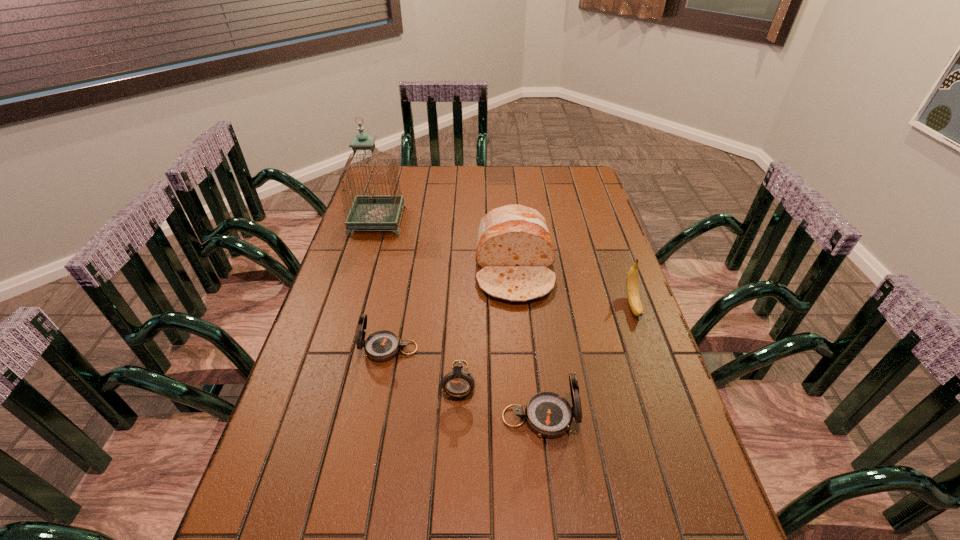
At what (x,y) coordinates should I click in order to perform the action: click on free space located 0.050m on the face of the second tallest compass. Please return your answer as a coordinate pair (x, y). Looking at the image, I should click on (342, 349).

You are a GUI agent. You are given a task and a screenshot of the screen. Output one action in this format:
    pyautogui.click(x=<x>, y=<y>)
    Task: Click on the vacant space situated on the face of the shortest object
    
    Given the screenshot: What is the action you would take?
    pyautogui.click(x=457, y=430)

Find the location of a particular element. This screenshot has height=540, width=960. blank space located on the face of the rightmost compass is located at coordinates (630, 417).

Find the location of a particular element. Image resolution: width=960 pixels, height=540 pixels. vacant position located 0.110m at the door of the farthest object is located at coordinates (433, 221).

Where is `free spot located 0.050m at the sliced end of the bread`? free spot located 0.050m at the sliced end of the bread is located at coordinates (519, 320).

Identify the location of vacant space located at the start of the peel on the banana. (684, 447).

Where is `compass located at the left edge`? This screenshot has height=540, width=960. compass located at the left edge is located at coordinates (383, 345).

Find the location of a particular element. This screenshot has height=540, width=960. birdcage located at the left edge is located at coordinates (371, 211).

Where is `object that is at the right edge`? object that is at the right edge is located at coordinates (632, 288).

In the image, there is a desktop. At what (x,y) coordinates should I click in order to perform the action: click on free space at the far edge. Please return your answer as a coordinate pair (x, y). This screenshot has width=960, height=540. Looking at the image, I should click on 544,192.